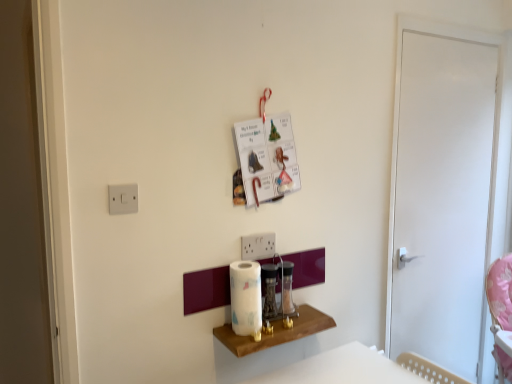
Where is `wooden shelf at center`? wooden shelf at center is located at coordinates [276, 332].

Where is `clear glass jar at center, placed as the 2th appliance when sorted from left to right`? clear glass jar at center, placed as the 2th appliance when sorted from left to right is located at coordinates (287, 288).

What do you see at coordinates (123, 199) in the screenshot?
I see `white plastic light switch at upper left` at bounding box center [123, 199].

At what (x,y) coordinates should I click in order to perform the action: click on wooden shelf at center. Please return your answer as a coordinate pair (x, y). Looking at the image, I should click on (276, 332).

How different are the orientations of wooden shelf at center and white plastic light switch at upper left in degrees?

The angular difference between wooden shelf at center and white plastic light switch at upper left is 0.521 degrees.

In terms of size, does wooden shelf at center appear bigger or smaller than white plastic light switch at upper left?

Clearly, wooden shelf at center is larger in size than white plastic light switch at upper left.

Is point (260, 346) positioned in front of point (126, 200)?

That is False.

Which object is further away from the camera taking this photo, clear glass jar at center, which is counted as the 1th appliance, starting from the right, or white glossy door at right?

white glossy door at right is behind.

From the image's perspective, does clear glass jar at center, which is counted as the 1th appliance, starting from the right, appear lower than white glossy door at right?

Yes, from the image's perspective, clear glass jar at center, which is counted as the 1th appliance, starting from the right, is below white glossy door at right.

From a real-world perspective, between clear glass jar at center, which is counted as the 1th appliance, starting from the right, and white glossy door at right, who is vertically lower?

In real-world perspective, clear glass jar at center, which is counted as the 1th appliance, starting from the right, is lower.

Find the location of a particular element. appliance that is the 1st object located in front of the white glossy door at right is located at coordinates (287, 288).

Looking at their sizes, would you say wooden shelf at center is wider or thinner than white glossy door at right?

In the image, wooden shelf at center appears to be wider than white glossy door at right.

Is point (240, 354) more distant than point (451, 226)?

No.

Can you confirm if wooden shelf at center is taller than white glossy door at right?

In fact, wooden shelf at center may be shorter than white glossy door at right.

Is wooden shelf at center facing towards white glossy door at right?

No.

At what (x,y) coordinates should I click in order to perform the action: click on paper towel below the white plastic light switch at upper left (from the image's perspective). Please return your answer as a coordinate pair (x, y). Looking at the image, I should click on (246, 298).

From a real-world perspective, which object rests below the other?

white glossy paper towel at center, from a real-world perspective.

Is white glossy paper towel at center not close to white plastic light switch at upper left?

white glossy paper towel at center is actually quite close to white plastic light switch at upper left.

Can you confirm if white glossy paper towel at center is positioned to the right of white plastic light switch at upper left?

Yes.

Which is more to the right, wooden shelf at center or metallic silver blender at center, placed as the first appliance when sorted from left to right?

Positioned to the right is wooden shelf at center.

Would you say wooden shelf at center is outside metallic silver blender at center, placed as the first appliance when sorted from left to right?

That's correct, wooden shelf at center is outside of metallic silver blender at center, placed as the first appliance when sorted from left to right.

From the image's perspective, which one is positioned higher, wooden shelf at center or metallic silver blender at center, placed as the first appliance when sorted from left to right?

metallic silver blender at center, placed as the first appliance when sorted from left to right, is shown above in the image.

Which is less distant, (321, 316) or (270, 316)?

Point (270, 316)

Considering the relative sizes of wooden shelf at center and clear glass jar at center, placed as the 2th appliance when sorted from left to right, in the image provided, is wooden shelf at center shorter than clear glass jar at center, placed as the 2th appliance when sorted from left to right,?

Correct, wooden shelf at center is not as tall as clear glass jar at center, placed as the 2th appliance when sorted from left to right.

Considering the positions of objects wooden shelf at center and clear glass jar at center, which is counted as the 1th appliance, starting from the right, in the image provided, who is more to the right, wooden shelf at center or clear glass jar at center, which is counted as the 1th appliance, starting from the right,?

clear glass jar at center, which is counted as the 1th appliance, starting from the right, is more to the right.

Between wooden shelf at center and clear glass jar at center, which is counted as the 1th appliance, starting from the right, which one has smaller size?

clear glass jar at center, which is counted as the 1th appliance, starting from the right, is smaller.

How many degrees apart are the facing directions of wooden shelf at center and clear glass jar at center, placed as the 2th appliance when sorted from left to right?

The angle between the facing direction of wooden shelf at center and the facing direction of clear glass jar at center, placed as the 2th appliance when sorted from left to right, is 0.518 degrees.

What's the angular difference between white glossy paper towel at center and wooden shelf at center's facing directions?

0.519 degrees separate the facing orientations of white glossy paper towel at center and wooden shelf at center.

Is white glossy paper towel at center closer to camera compared to wooden shelf at center?

No, white glossy paper towel at center is further to the viewer.

Does white glossy paper towel at center turn towards wooden shelf at center?

No.

Is white glossy paper towel at center next to wooden shelf at center?

They are not placed beside each other.

At what (x,y) coordinates should I click in order to perform the action: click on furniture on the right of white plastic light switch at upper left. Please return your answer as a coordinate pair (x, y). This screenshot has width=512, height=384. Looking at the image, I should click on (276, 332).

This screenshot has height=384, width=512. Identify the location of screen door above the clear glass jar at center, placed as the 2th appliance when sorted from left to right (from a real-world perspective). pos(442,194).

Looking at the image, which one is located closer to white glossy door at right, white plastic light switch at upper left or white glossy paper towel at center?

white glossy paper towel at center is closer to white glossy door at right.

Based on their spatial positions, is white glossy paper towel at center or white glossy door at right closer to metallic silver blender at center, placed as the 2th appliance when sorted from right to left?

white glossy paper towel at center.

Looking at the image, which one is located further to clear glass jar at center, placed as the 2th appliance when sorted from left to right, white glossy door at right or white plastic light switch at upper left?

white glossy door at right.

Based on their spatial positions, is wooden shelf at center or white glossy door at right further from clear glass jar at center, placed as the 2th appliance when sorted from left to right?

white glossy door at right is positioned further to the anchor clear glass jar at center, placed as the 2th appliance when sorted from left to right.

Based on their spatial positions, is metallic silver blender at center, placed as the 2th appliance when sorted from right to left, or clear glass jar at center, which is counted as the 1th appliance, starting from the right, further from white glossy door at right?

metallic silver blender at center, placed as the 2th appliance when sorted from right to left, is positioned further to the anchor white glossy door at right.

Which object lies further to the anchor point white glossy paper towel at center, metallic silver blender at center, placed as the first appliance when sorted from left to right, or wooden shelf at center?

Based on the image, wooden shelf at center appears to be further to white glossy paper towel at center.

Looking at the image, which one is located closer to white plastic light switch at upper left, white glossy paper towel at center or wooden shelf at center?

Based on the image, white glossy paper towel at center appears to be nearer to white plastic light switch at upper left.

Estimate the real-world distances between objects in this image. Which object is closer to clear glass jar at center, placed as the 2th appliance when sorted from left to right, white plastic light switch at upper left or wooden shelf at center?

wooden shelf at center is closer to clear glass jar at center, placed as the 2th appliance when sorted from left to right.

You are a GUI agent. You are given a task and a screenshot of the screen. Output one action in this format:
    pyautogui.click(x=<x>, y=<y>)
    Task: Click on the appliance between wooden shelf at center and clear glass jar at center, placed as the 2th appliance when sorted from left to right, from front to back
    This screenshot has width=512, height=384.
    Given the screenshot: What is the action you would take?
    pyautogui.click(x=269, y=290)

Locate an element on the screen. This screenshot has height=384, width=512. paper towel situated between white plastic light switch at upper left and wooden shelf at center from left to right is located at coordinates (246, 298).

At what (x,y) coordinates should I click in order to perform the action: click on appliance between wooden shelf at center and white glossy door at right in the horizontal direction. Please return your answer as a coordinate pair (x, y). Looking at the image, I should click on [x=287, y=288].

Image resolution: width=512 pixels, height=384 pixels. What are the coordinates of `furniture between white plastic light switch at upper left and clear glass jar at center, placed as the 2th appliance when sorted from left to right` in the screenshot? It's located at (276, 332).